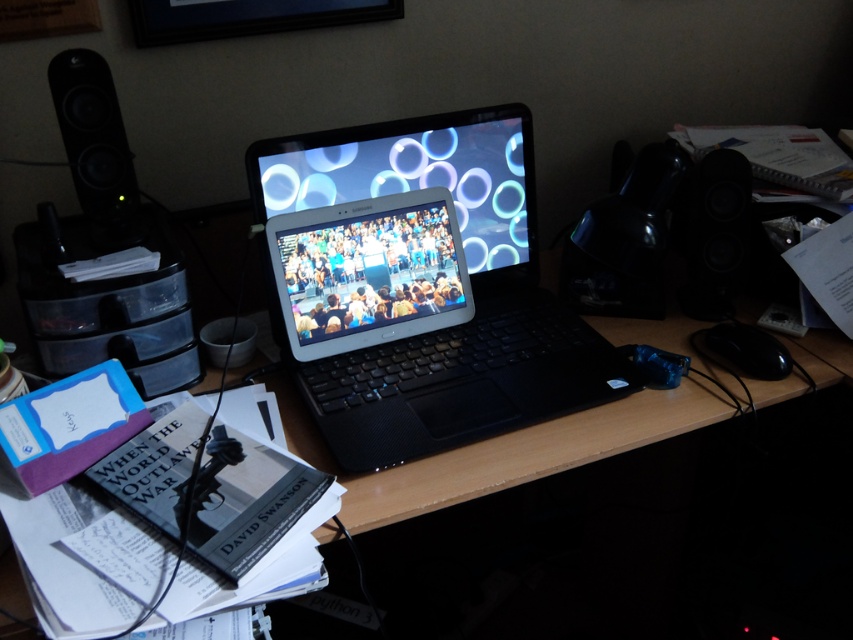
You are organizing the desk and want to place a new item between the satin silver tablet at center and the black matte speaker at right. Is there enough space between them to fit a 5 cm wide notebook?

The satin silver tablet at center is positioned on the left side of black matte speaker at right. Since the exact distance between them isn

You are organizing a tech fair and need to place the satin silver tablet at center and the black matte speaker at right on a table. If the table has limited space, which device should you prioritize placing first to ensure both fit?

The satin silver tablet at center is larger in size than the black matte speaker at right, so you should place the satin silver tablet at center first to ensure both fit on the table.